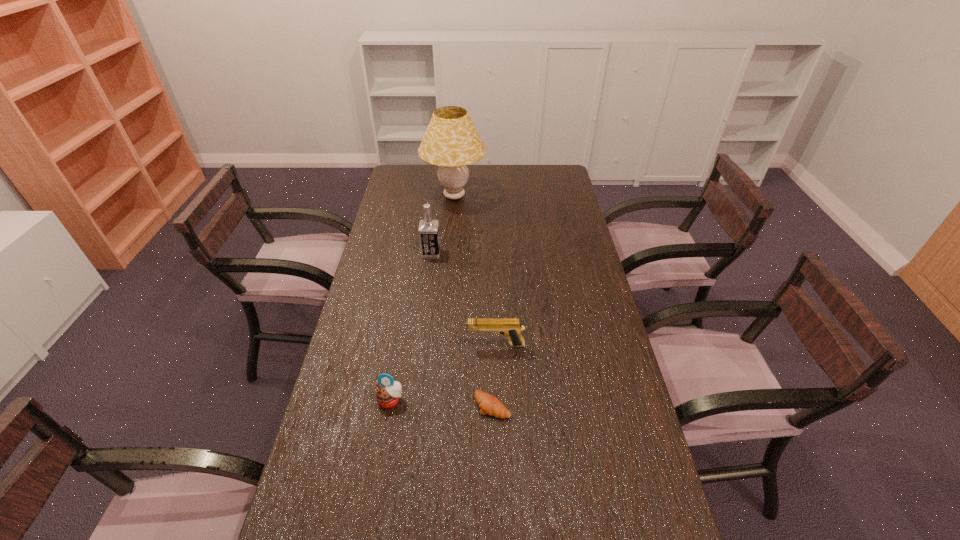
Locate an element on the screen. The image size is (960, 540). vacant region between the lampshade and the muffin is located at coordinates (422, 298).

Where is `free point between the muffin and the fourth nearest object`? This screenshot has height=540, width=960. free point between the muffin and the fourth nearest object is located at coordinates (411, 327).

Locate an element on the screen. object that stands as the fourth closest to the shortest object is located at coordinates (451, 141).

You are a GUI agent. You are given a task and a screenshot of the screen. Output one action in this format:
    pyautogui.click(x=<x>, y=<y>)
    Task: Click on the object that ranks as the closest to the shortest object
    The height and width of the screenshot is (540, 960).
    Given the screenshot: What is the action you would take?
    510,327

You are a GUI agent. You are given a task and a screenshot of the screen. Output one action in this format:
    pyautogui.click(x=<x>, y=<y>)
    Task: Click on the free point that satisfies the following two spatial constraints: 1. on the back side of the shortest object; 2. on the front label of the second farthest object
    The width and height of the screenshot is (960, 540).
    Given the screenshot: What is the action you would take?
    point(489,253)

At what (x,y) coordinates should I click in order to perform the action: click on free spot that satisfies the following two spatial constraints: 1. on the front side of the tallest object; 2. on the left side of the shortest object. Please return your answer as a coordinate pair (x, y). This screenshot has width=960, height=540. Looking at the image, I should click on (437, 406).

You are a GUI agent. You are given a task and a screenshot of the screen. Output one action in this format:
    pyautogui.click(x=<x>, y=<y>)
    Task: Click on the free space that satisfies the following two spatial constraints: 1. on the front-facing side of the muffin; 2. on the right side of the crescent roll
    
    Given the screenshot: What is the action you would take?
    pyautogui.click(x=390, y=406)

You are a GUI agent. You are given a task and a screenshot of the screen. Output one action in this format:
    pyautogui.click(x=<x>, y=<y>)
    Task: Click on the vacant region that satisfies the following two spatial constraints: 1. at the barrel of the pistol; 2. on the front-facing side of the muffin
    The height and width of the screenshot is (540, 960).
    Given the screenshot: What is the action you would take?
    pyautogui.click(x=497, y=400)

Find the location of a particular element. The width and height of the screenshot is (960, 540). free spot that satisfies the following two spatial constraints: 1. at the barrel of the pistol; 2. on the front-facing side of the muffin is located at coordinates (497, 400).

I want to click on vacant space that satisfies the following two spatial constraints: 1. on the front-facing side of the muffin; 2. on the left side of the shortest object, so click(390, 406).